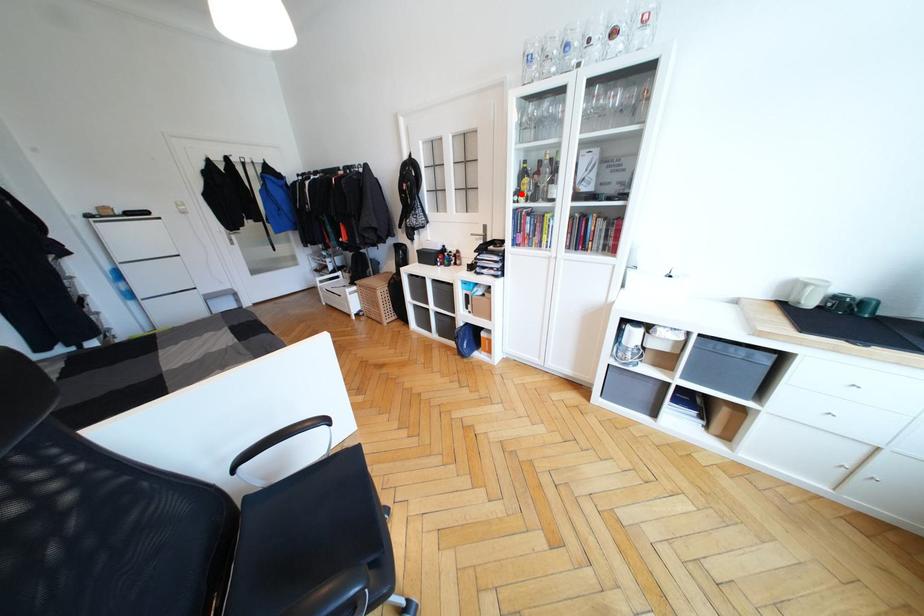
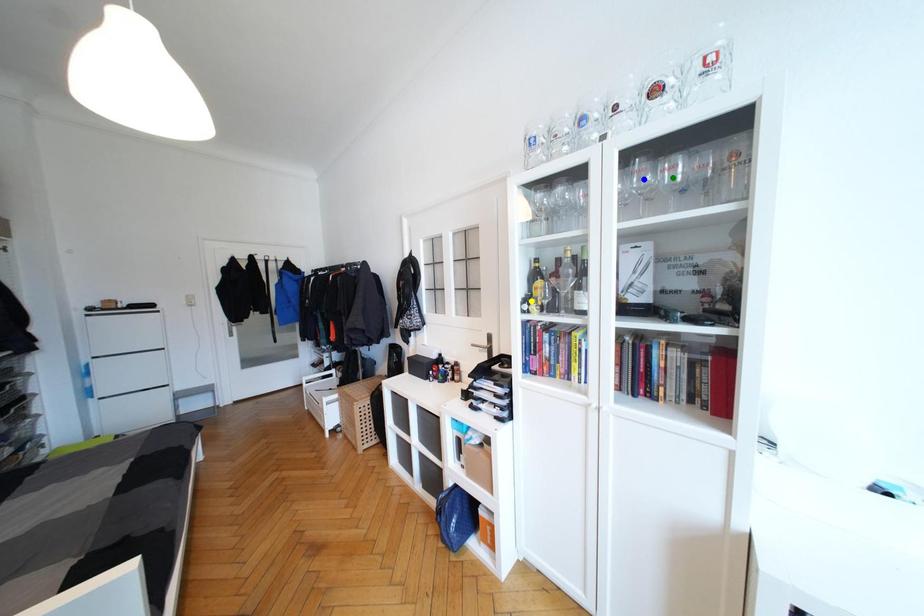
Question: I am providing you with two images of the same scene from different viewpoints. A red point is marked on the first image. You are given multiple points on the second image. Which point in image 2 represents the same 3d spot as the red point in image 1?

Choices:
 (A) green point
 (B) yellow point
 (C) blue point

Answer: (B)